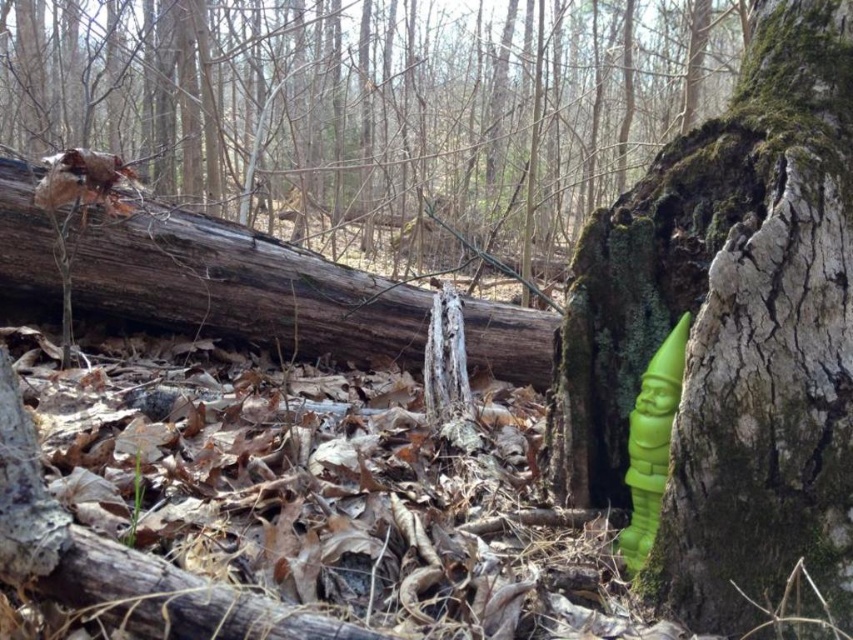
Question: Is green matte gnome at center to the right of green matte gnome at right from the viewer's perspective?

Choices:
 (A) yes
 (B) no

Answer: (A)

Question: Which is farther from the green matte gnome at center?

Choices:
 (A) green matte gnome at right
 (B) green plastic gnome at right

Answer: (B)

Question: Which object appears closest to the camera in this image?

Choices:
 (A) green plastic gnome at right
 (B) green matte gnome at right

Answer: (B)

Question: Is green plastic gnome at right in front of green matte gnome at center?

Choices:
 (A) yes
 (B) no

Answer: (B)

Question: Is green plastic gnome at right smaller than green matte gnome at right?

Choices:
 (A) no
 (B) yes

Answer: (A)

Question: Which of the following is the farthest from the observer?

Choices:
 (A) green matte gnome at center
 (B) green matte gnome at right
 (C) green plastic gnome at right

Answer: (C)